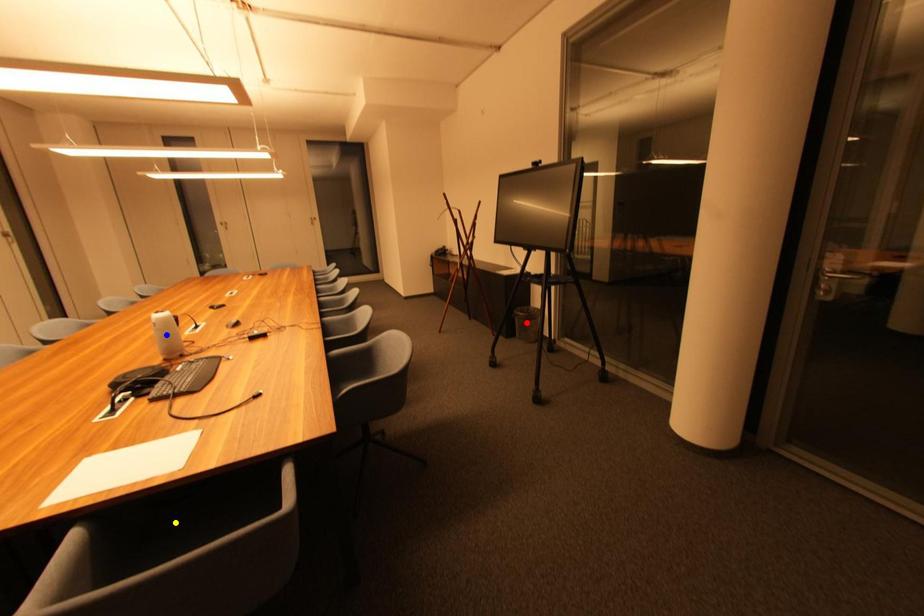
Order these from nearest to farthest:
- yellow point
- red point
- blue point

yellow point < blue point < red point